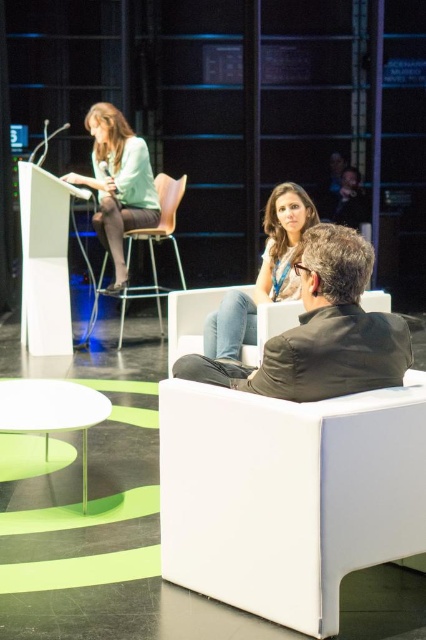
Is point (189, 358) more distant than point (74, 404)?

No, (189, 358) is closer to viewer.

Based on the photo, does dark brown leather jacket at center appear under white plastic stool at lower left?

No, dark brown leather jacket at center is not below white plastic stool at lower left.

Between point (331, 291) and point (58, 381), which one is positioned in front?

Positioned in front is point (331, 291).

The height and width of the screenshot is (640, 426). I want to click on dark brown leather jacket at center, so click(322, 332).

Can you confirm if dark brown leather jacket at center is wider than matte black stool at center?

Correct, the width of dark brown leather jacket at center exceeds that of matte black stool at center.

Is point (333, 284) positioned behind point (94, 282)?

No, it is in front of (94, 282).

Does point (400, 356) lie in front of point (163, 196)?

That is True.

Where is `dark brown leather jacket at center`? dark brown leather jacket at center is located at coordinates (322, 332).

Is dark brown leather jacket at center shorter than matte green shirt at upper left?

Indeed, dark brown leather jacket at center has a lesser height compared to matte green shirt at upper left.

Is dark brown leather jacket at center positioned behind matte green shirt at upper left?

That is False.

Locate an element on the screen. dark brown leather jacket at center is located at coordinates (322, 332).

This screenshot has width=426, height=640. What are the coordinates of `dark brown leather jacket at center` in the screenshot? It's located at (322, 332).